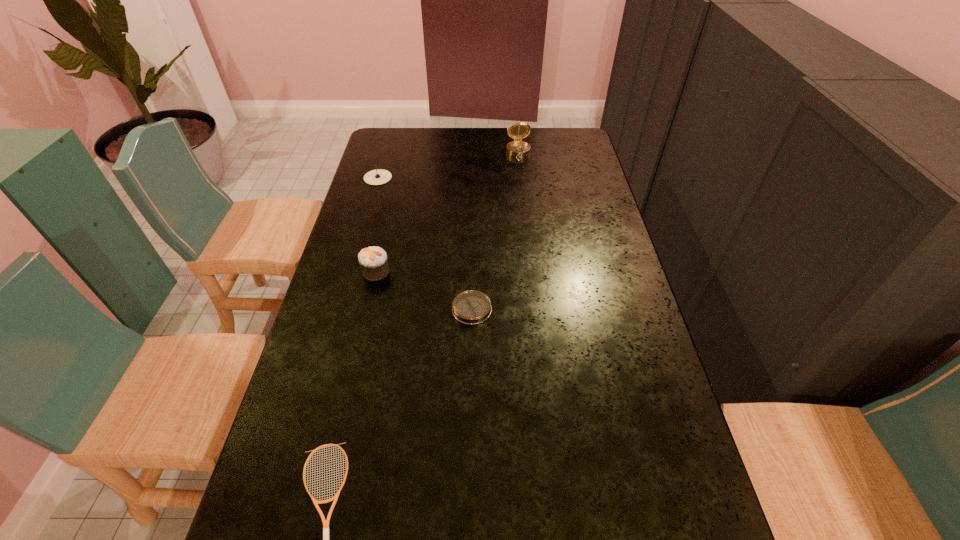
I want to click on vacant region located 0.230m on the right of the second shortest compass, so click(x=454, y=178).

Locate an element on the screen. This screenshot has height=540, width=960. free location located on the left of the shortest compass is located at coordinates (370, 309).

Where is `object that is at the far edge`? The width and height of the screenshot is (960, 540). object that is at the far edge is located at coordinates (517, 148).

The width and height of the screenshot is (960, 540). I want to click on cupcake that is at the left edge, so click(373, 262).

Locate an element on the screen. compass that is at the left edge is located at coordinates (379, 176).

Find the location of a particular element. free space at the far edge of the desktop is located at coordinates (502, 141).

Where is `free space at the left edge of the desktop`? This screenshot has height=540, width=960. free space at the left edge of the desktop is located at coordinates (393, 241).

In the image, there is a desktop. Where is `vacant region at the right edge`? The height and width of the screenshot is (540, 960). vacant region at the right edge is located at coordinates (563, 193).

This screenshot has height=540, width=960. What are the coordinates of `free space that is in between the second compass from right to left and the cupcake` in the screenshot? It's located at (423, 290).

Where is `vacant area between the rightmost object and the shortest compass`? This screenshot has height=540, width=960. vacant area between the rightmost object and the shortest compass is located at coordinates [495, 231].